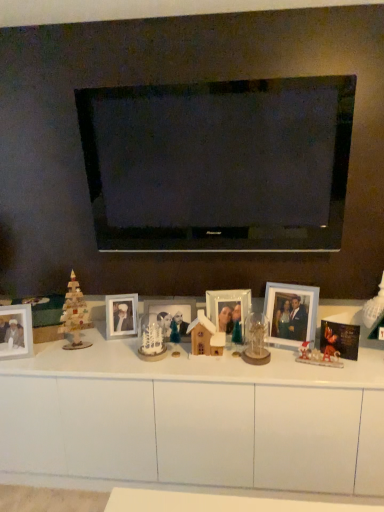
Question: Does metallic gold ornament at center-right, positioned as the 3th toy in left-to-right order, have a greater width compared to matte glass photo frame at center, positioned as the 3th picture frame in right-to-left order?

Choices:
 (A) yes
 (B) no

Answer: (B)

Question: Considering the relative sizes of metallic gold ornament at center-right, which is the first toy from right to left, and matte glass photo frame at center, the 3th picture frame in the left-to-right sequence, in the image provided, is metallic gold ornament at center-right, which is the first toy from right to left, bigger than matte glass photo frame at center, the 3th picture frame in the left-to-right sequence,?

Choices:
 (A) no
 (B) yes

Answer: (A)

Question: Are metallic gold ornament at center-right, positioned as the 3th toy in left-to-right order, and matte glass photo frame at center, positioned as the 3th picture frame in right-to-left order, beside each other?

Choices:
 (A) no
 (B) yes

Answer: (A)

Question: Would you say metallic gold ornament at center-right, positioned as the 3th toy in left-to-right order, contains matte glass photo frame at center, positioned as the 3th picture frame in right-to-left order?

Choices:
 (A) yes
 (B) no

Answer: (B)

Question: Can you confirm if metallic gold ornament at center-right, which is the first toy from right to left, is shorter than matte glass photo frame at center, positioned as the 3th picture frame in right-to-left order?

Choices:
 (A) no
 (B) yes

Answer: (B)

Question: From a real-world perspective, is wooden house at center, which is the second toy in right-to-left order, physically located above or below metallic silver photo frame at center, the 4th picture frame in the left-to-right sequence?

Choices:
 (A) below
 (B) above

Answer: (A)

Question: Considering the positions of wooden house at center, which is the second toy in right-to-left order, and metallic silver photo frame at center, the 4th picture frame in the left-to-right sequence, in the image, is wooden house at center, which is the second toy in right-to-left order, taller or shorter than metallic silver photo frame at center, the 4th picture frame in the left-to-right sequence,?

Choices:
 (A) tall
 (B) short

Answer: (B)

Question: Considering the positions of wooden house at center, the second toy in the left-to-right sequence, and metallic silver photo frame at center, the 4th picture frame in the left-to-right sequence, in the image, is wooden house at center, the second toy in the left-to-right sequence, wider or thinner than metallic silver photo frame at center, the 4th picture frame in the left-to-right sequence,?

Choices:
 (A) thin
 (B) wide

Answer: (B)

Question: In the image, is wooden house at center, the second toy in the left-to-right sequence, positioned in front of or behind metallic silver photo frame at center, the 4th picture frame in the left-to-right sequence?

Choices:
 (A) behind
 (B) front

Answer: (B)

Question: Is metallic silver photo frame at center, positioned as the 2th picture frame in right-to-left order, in front of or behind wooden house at center, which is the second toy in right-to-left order, in the image?

Choices:
 (A) front
 (B) behind

Answer: (B)

Question: From the image's perspective, is metallic silver photo frame at center, the 4th picture frame in the left-to-right sequence, above or below wooden house at center, which is the second toy in right-to-left order?

Choices:
 (A) below
 (B) above

Answer: (B)

Question: Looking at their shapes, would you say metallic silver photo frame at center, positioned as the 2th picture frame in right-to-left order, is wider or thinner than wooden house at center, which is the second toy in right-to-left order?

Choices:
 (A) wide
 (B) thin

Answer: (B)

Question: Is metallic silver photo frame at center, the 4th picture frame in the left-to-right sequence, inside the boundaries of wooden house at center, which is the second toy in right-to-left order, or outside?

Choices:
 (A) inside
 (B) outside

Answer: (B)

Question: Based on their sizes in the image, would you say white matte table at center is bigger or smaller than wooden house at center, which is the second toy in right-to-left order?

Choices:
 (A) big
 (B) small

Answer: (A)

Question: Would you say white matte table at center is to the left or to the right of wooden house at center, which is the second toy in right-to-left order, in the picture?

Choices:
 (A) right
 (B) left

Answer: (B)